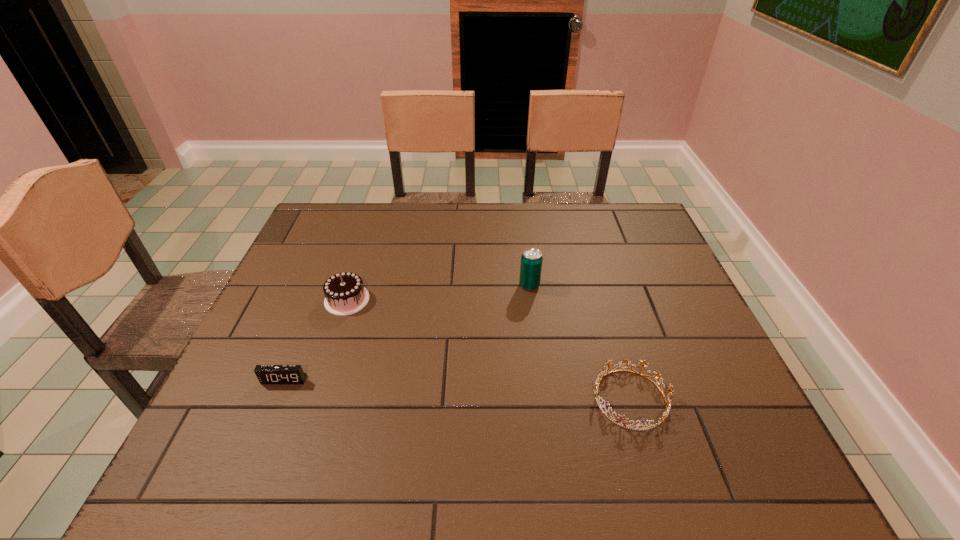
Identify the location of the third object from left to right. The image size is (960, 540). (531, 260).

At what (x,y) coordinates should I click in order to perform the action: click on the tallest object. Please return your answer as a coordinate pair (x, y). The image size is (960, 540). Looking at the image, I should click on (531, 260).

Find the location of `the third shortest object`. the third shortest object is located at coordinates (345, 294).

Find the location of `the rightmost object`. the rightmost object is located at coordinates pos(602,375).

Where is `alarm clock`? alarm clock is located at coordinates (267, 374).

This screenshot has width=960, height=540. What are the coordinates of `free point located on the back of the second object from right to left` in the screenshot? It's located at (524, 245).

You are a GUI agent. You are given a task and a screenshot of the screen. Output one action in this format:
    pyautogui.click(x=<x>, y=<y>)
    Task: Click on the vacant space situated 0.250m on the right of the second tallest object
    This screenshot has height=540, width=960.
    Given the screenshot: What is the action you would take?
    pyautogui.click(x=463, y=300)

Locate an element on the screen. The height and width of the screenshot is (540, 960). free location located on the front-facing side of the tiara is located at coordinates (424, 399).

Locate an element on the screen. free space located on the front-facing side of the tiara is located at coordinates (517, 399).

Identify the location of vacant space located 0.110m on the front-facing side of the tiara. (541, 399).